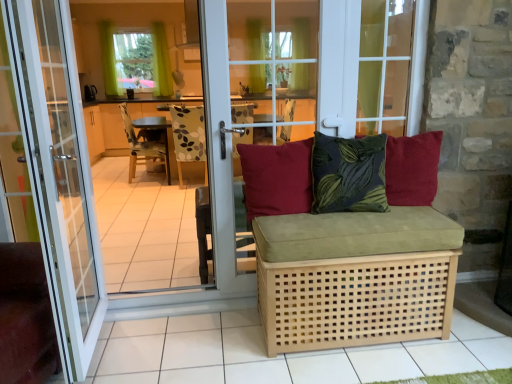
Question: Can you confirm if red cotton cushion at center, the first pillow when ordered from right to left, is bigger than green fabric curtain at upper left, the second window from the right?

Choices:
 (A) yes
 (B) no

Answer: (B)

Question: Can you confirm if red cotton cushion at center, the third pillow from the left, is shorter than green fabric curtain at upper left, the second window from the right?

Choices:
 (A) yes
 (B) no

Answer: (A)

Question: From the image's perspective, is red cotton cushion at center, the third pillow from the left, above green fabric curtain at upper left, the second window from the front?

Choices:
 (A) no
 (B) yes

Answer: (A)

Question: From the image's perspective, is red cotton cushion at center, the third pillow from the left, beneath green fabric curtain at upper left, the 1th window positioned from the top?

Choices:
 (A) no
 (B) yes

Answer: (B)

Question: Can you confirm if red cotton cushion at center, the third pillow from the left, is taller than green fabric curtain at upper left, the 2th window in the bottom-to-top sequence?

Choices:
 (A) yes
 (B) no

Answer: (B)

Question: Considering the relative sizes of red cotton cushion at center, the third pillow from the left, and green fabric curtain at upper left, the second window from the front, in the image provided, is red cotton cushion at center, the third pillow from the left, thinner than green fabric curtain at upper left, the second window from the front,?

Choices:
 (A) no
 (B) yes

Answer: (A)

Question: Can we say green fabric curtain at upper left, the second window from the right, lies outside light brown woven studio couch at center?

Choices:
 (A) no
 (B) yes

Answer: (B)

Question: Is the position of green fabric curtain at upper left, the second window from the right, more distant than that of light brown woven studio couch at center?

Choices:
 (A) no
 (B) yes

Answer: (B)

Question: From a real-world perspective, is green fabric curtain at upper left, acting as the first window starting from the left, beneath light brown woven studio couch at center?

Choices:
 (A) yes
 (B) no

Answer: (B)

Question: Is green fabric curtain at upper left, the second window from the right, closer to the viewer compared to light brown woven studio couch at center?

Choices:
 (A) no
 (B) yes

Answer: (A)

Question: Does green fabric curtain at upper left, the 1th window when ordered from back to front, have a lesser height compared to light brown woven studio couch at center?

Choices:
 (A) no
 (B) yes

Answer: (A)

Question: Can you confirm if green fabric curtain at upper left, the second window from the right, is thinner than light brown woven studio couch at center?

Choices:
 (A) no
 (B) yes

Answer: (B)

Question: Is transparent glass door at center taller than wooden chair at center?

Choices:
 (A) no
 (B) yes

Answer: (B)